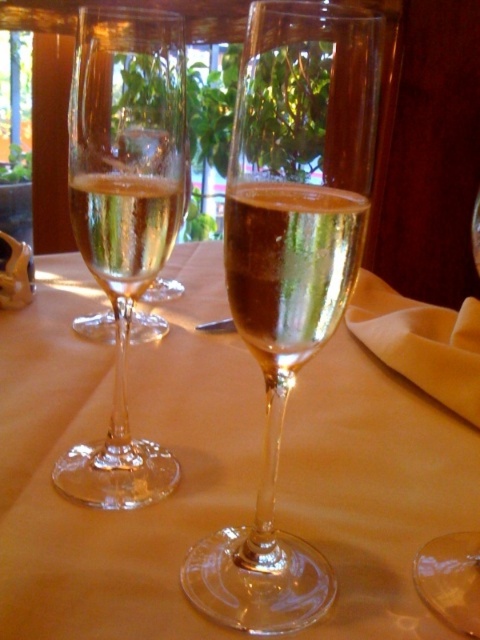
You are positioning a centerpiece for a table and need to place it in the exact center of the table. The clear glass wine glasses at center are currently at point 0.680, 0.281. Will placing the centerpiece at the table center cause it to overlap with the glasses?

The clear glass wine glasses at center are located at point (134, 435), so placing the centerpiece at the table center would not overlap with them since their coordinates are offset from the center.

You are a waiter at a restaurant and need to place a dessert plate between the clear glass wine glass at center and the clear glass champagne at center. The plate is 1.2 inches wide. Will there be enough space between the two glasses to fit the plate?

The clear glass wine glass at center and clear glass champagne at center are 1.05 inches apart. Since the plate is 1.2 inches wide, it is wider than the space between them. Therefore, the plate cannot fit between the two glasses.

You are a bartender preparing to stack these two glasses for storage. The clear glass champagne at left and the transparent glass at center need to be placed one inside the other. Which glass should you place inside the other?

The clear glass champagne at left is thinner than transparent glass at center, so you should place the clear glass champagne at left inside the transparent glass at center to ensure a proper fit without breaking.